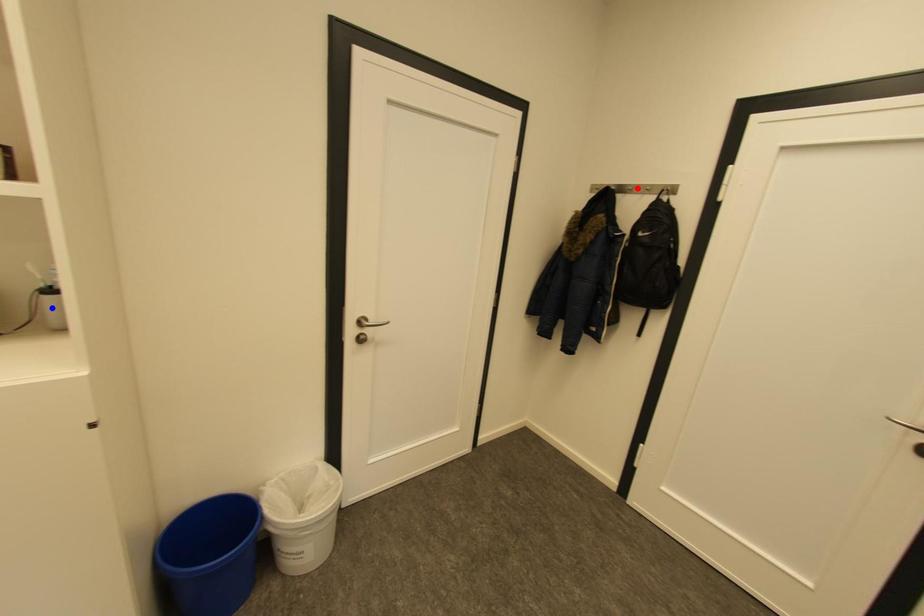
Question: In the image, two points are highlighted. Which point is nearer to the camera? Reply with the corresponding letter.

Choices:
 (A) blue point
 (B) red point

Answer: (A)